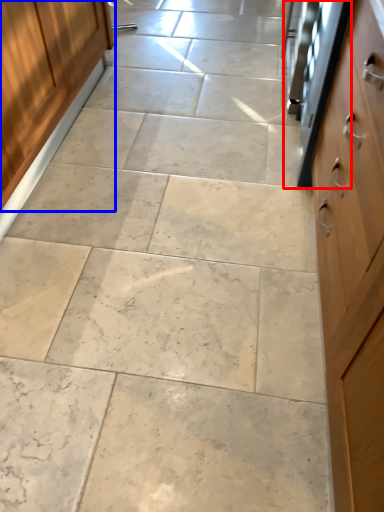
Question: Which of the following is the farthest to the observer, oven (highlighted by a red box) or cabinetry (highlighted by a blue box)?

Choices:
 (A) oven
 (B) cabinetry

Answer: (A)